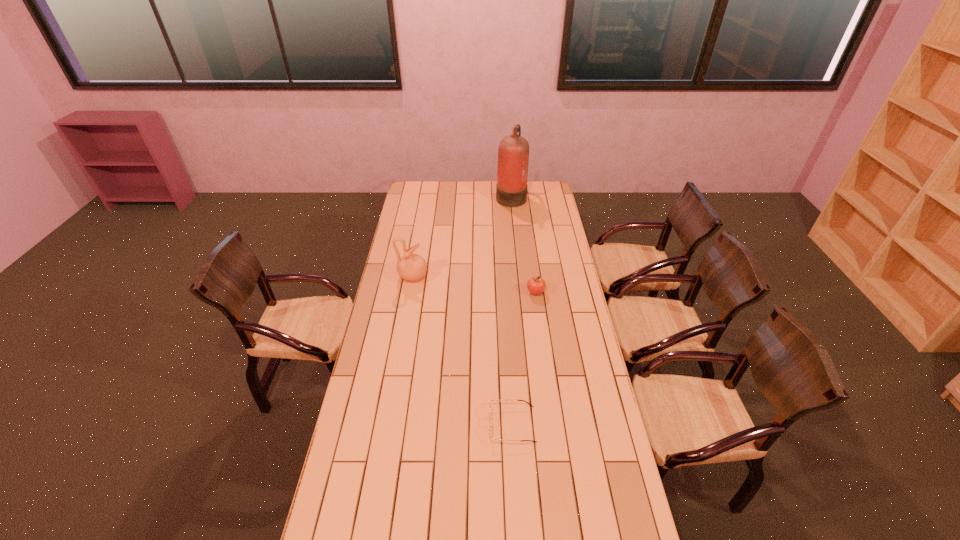
This screenshot has height=540, width=960. In order to click on blank space located 0.170m on the spout of the third shortest object in this screenshot , I will do `click(462, 277)`.

Find the location of `free space located on the left of the apple`. free space located on the left of the apple is located at coordinates (482, 292).

This screenshot has width=960, height=540. Find the location of `vacant area situated on the lenses of the shortest object`. vacant area situated on the lenses of the shortest object is located at coordinates (407, 424).

The height and width of the screenshot is (540, 960). I want to click on free point located on the lenses of the shortest object, so click(x=468, y=424).

This screenshot has height=540, width=960. In order to click on free space located 0.290m on the lenses of the shortest object in this screenshot , I will do `click(407, 424)`.

Image resolution: width=960 pixels, height=540 pixels. What are the coordinates of `object that is at the far edge` in the screenshot? It's located at (513, 153).

I want to click on object present at the left edge, so click(x=412, y=267).

Image resolution: width=960 pixels, height=540 pixels. What are the coordinates of `object present at the right edge` in the screenshot? It's located at (536, 285).

In the image, there is a desktop. Where is `free space at the far edge`? The height and width of the screenshot is (540, 960). free space at the far edge is located at coordinates (473, 189).

At what (x,y) coordinates should I click in order to perform the action: click on blank space at the left edge of the desktop. Please return your answer as a coordinate pair (x, y). Looking at the image, I should click on (384, 442).